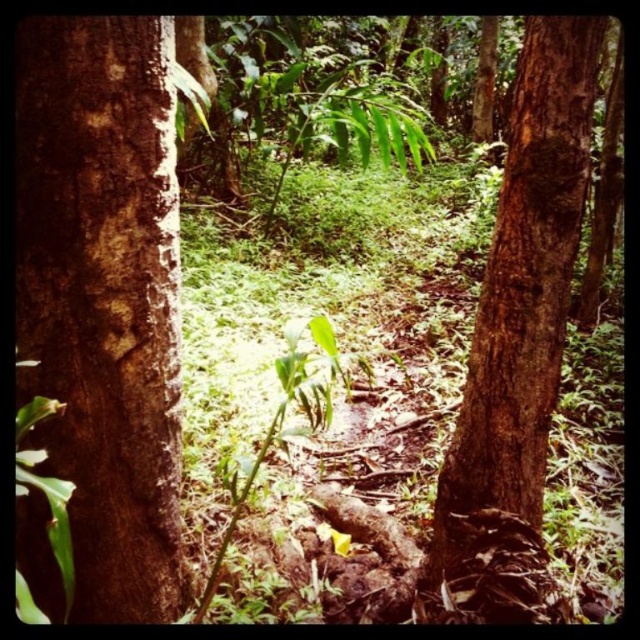
Between point (104, 38) and point (541, 333), which one is positioned behind?

The point (541, 333) is more distant.

Does point (83, 413) come in front of point (486, 509)?

Yes, point (83, 413) is closer to viewer.

Between point (115, 132) and point (531, 220), which one is positioned behind?

The point (531, 220) is more distant.

At what (x,y) coordinates should I click in order to perform the action: click on brown rough bark at left. Please return your answer as a coordinate pair (x, y). Looking at the image, I should click on (104, 298).